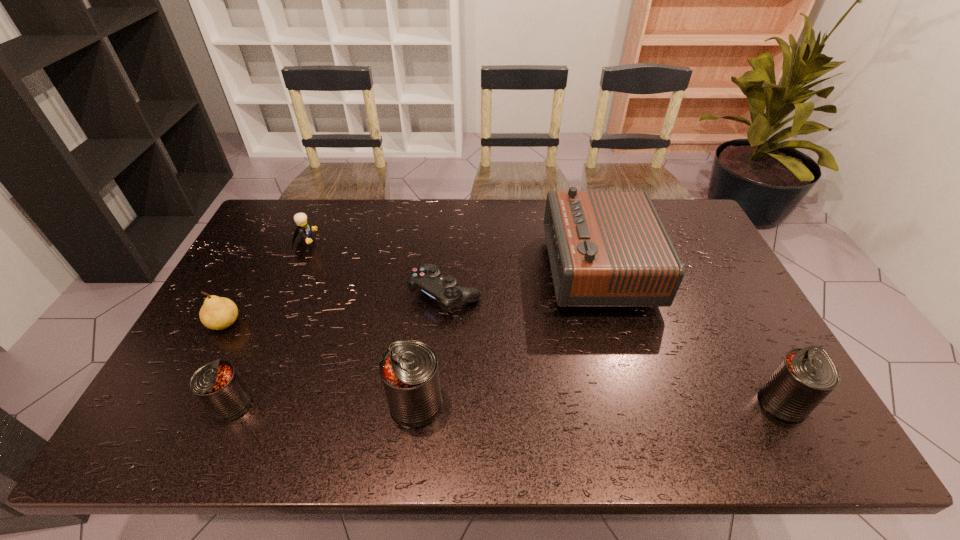
The height and width of the screenshot is (540, 960). Find the location of `Lego positioned at the left edge`. Lego positioned at the left edge is located at coordinates pyautogui.click(x=304, y=228).

You are a GUI agent. You are given a task and a screenshot of the screen. Output one action in this format:
    pyautogui.click(x=<x>, y=<y>)
    Task: Click on the pear situated at the left edge
    The image size is (960, 540).
    Given the screenshot: What is the action you would take?
    [217, 313]

Locate an element on the screen. This screenshot has height=540, width=960. object at the right edge is located at coordinates (805, 376).

Identify the location of object present at the far left corner. Image resolution: width=960 pixels, height=540 pixels. pyautogui.click(x=304, y=228).

The width and height of the screenshot is (960, 540). I want to click on object present at the near left corner, so click(217, 385).

The width and height of the screenshot is (960, 540). What are the coordinates of `object present at the near right corner` in the screenshot? It's located at (805, 376).

Where is `blank space at the far edge of the desktop`? blank space at the far edge of the desktop is located at coordinates (452, 212).

You are a GUI agent. You are given a task and a screenshot of the screen. Output one action in this format:
    pyautogui.click(x=<x>, y=<y>)
    Task: Click on the vacant space at the near edge of the desktop
    
    Given the screenshot: What is the action you would take?
    pyautogui.click(x=303, y=381)

In the image, there is a desktop. Identify the location of vacant space at the right edge. (709, 256).

This screenshot has height=540, width=960. What are the coordinates of `free space at the far left corner` in the screenshot? It's located at (264, 220).